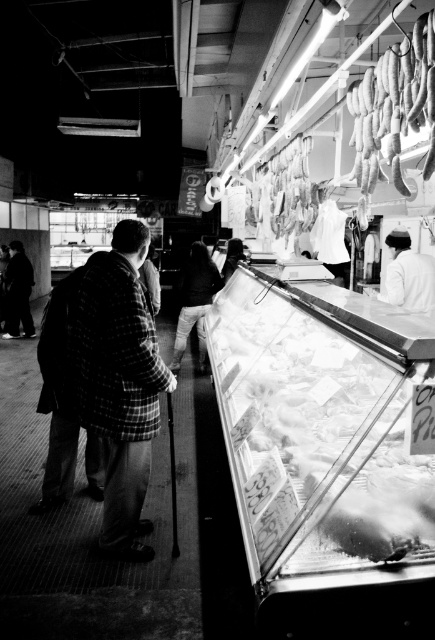
You are a customer in the market and want to buy a shirt. You see the plaid wool coat at center and the dark plaid shirt at center. Which item is located to the left of the other?

The plaid wool coat at center is positioned on the left side of dark plaid shirt at center.